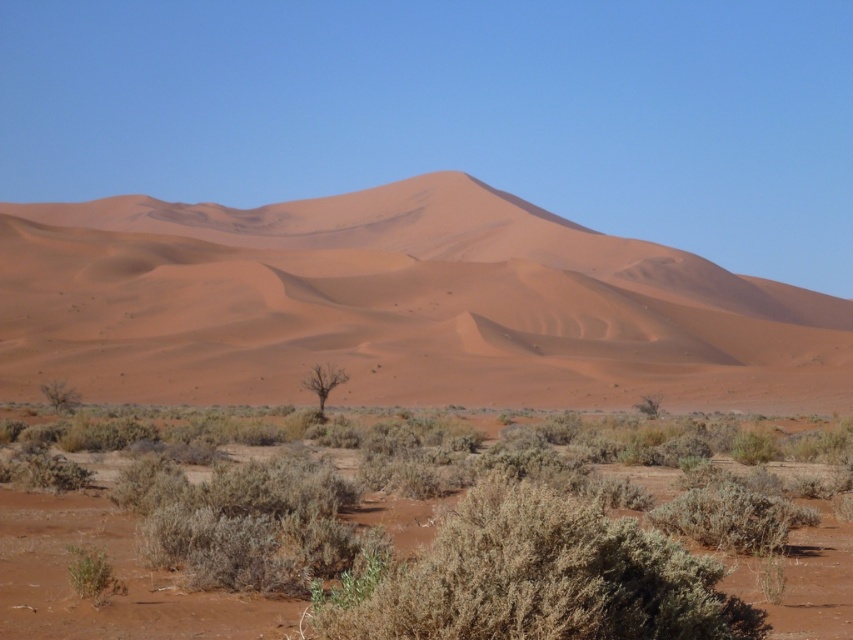
Question: Does sandy/dry textured dune at center have a larger size compared to green shrub at lower left?

Choices:
 (A) yes
 (B) no

Answer: (A)

Question: Which point is closer to the camera?

Choices:
 (A) green shrub at center
 (B) bare/dry tree at center

Answer: (A)

Question: Which object is closer to the camera taking this photo?

Choices:
 (A) green shrub at center
 (B) bare/dry tree at center
 (C) green shrub at lower left
 (D) sandy/dry textured dune at center

Answer: (A)

Question: Is sandy/dry textured dune at center bigger than bare/dry tree at center?

Choices:
 (A) no
 (B) yes

Answer: (B)

Question: Which of the following is the closest to the observer?

Choices:
 (A) green shrub at center
 (B) green shrub at lower left
 (C) sandy/dry textured dune at center

Answer: (A)

Question: Is sandy/dry textured dune at center bigger than green shrub at lower left?

Choices:
 (A) no
 (B) yes

Answer: (B)